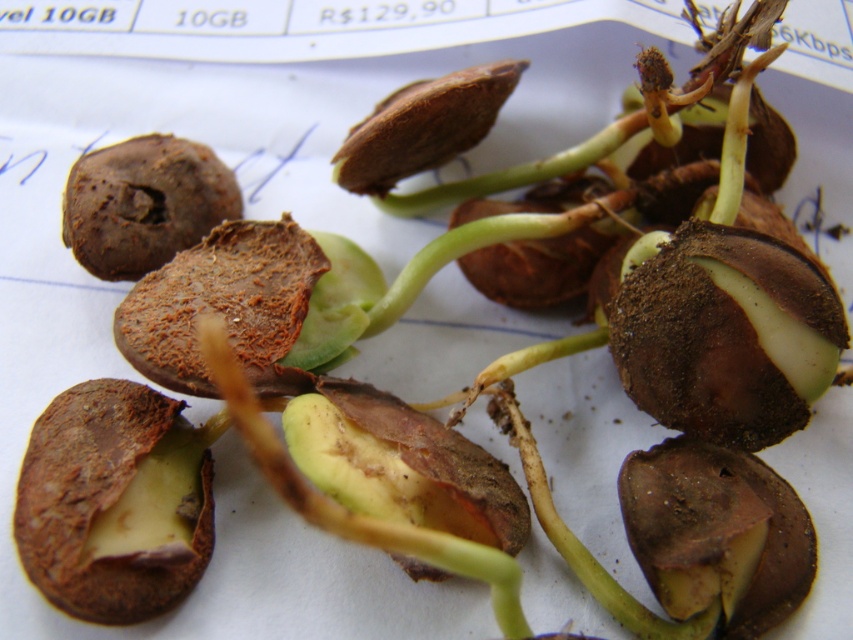
You are holding a magnifying glass and looking at the paper with the avocado seeds. You notice two points marked on the paper at coordinates point [705,406] and point [61,477]. Which point is closer to the edge of the paper?

Point [61,477] is closer to the edge of the paper because it has a lower y coordinate of 0.073 compared to 0.828, indicating it is positioned lower on the paper, closer to the bottom edge.